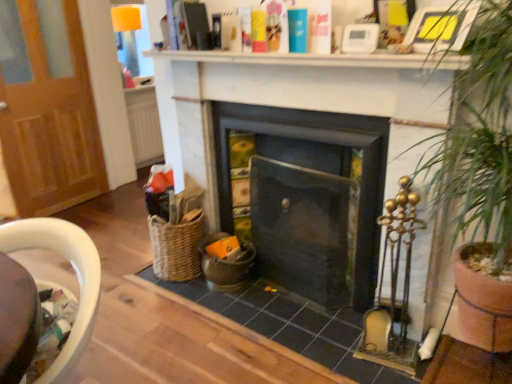
At what (x,y) coordinates should I click in order to perform the action: click on vacant space in wooden door at left (from a real-world perspective). Please return your answer as a coordinate pair (x, y). Looking at the image, I should click on (75, 202).